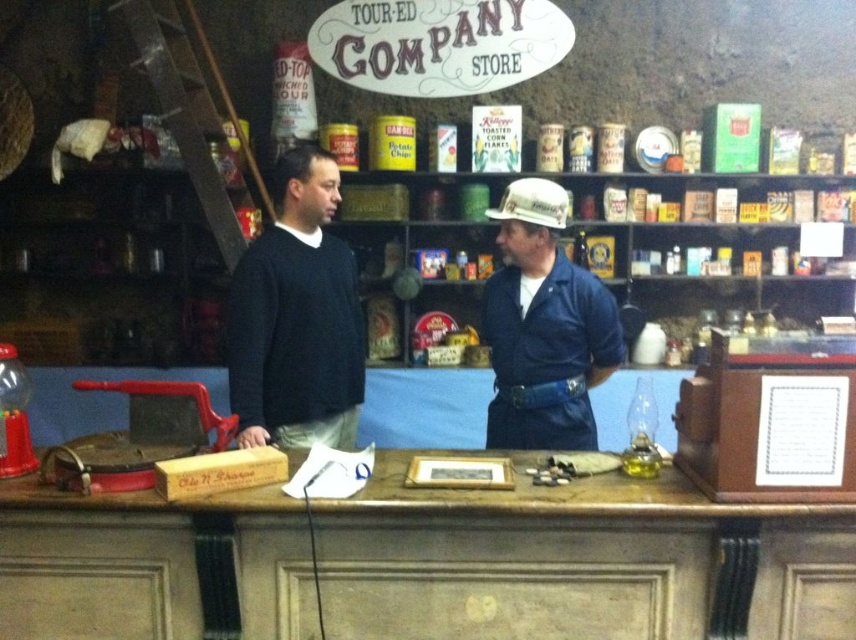
You are standing at the counter in the vintage store and see two points marked on the counter. The first point is at coordinates point (339,408) and the second point is at point (521,204). Which point is closer to you?

Point (339,408) is further to the camera than point (521,204), so the point closer to you is point (521,204).

Looking at this image, you are a customer in the store and want to hang both the dark blue sweater at center and the blue denim shirt at center on a single hanger. The hanger can only support items up to the height of the taller item. Will the hanger be sufficient for both?

The dark blue sweater at center is taller than the blue denim shirt at center. Since the hanger can support up to the height of the taller item, which is the dark blue sweater at center, the hanger will be sufficient for both items.

You are standing 10 feet away from the counter in the vintage store. There is a point at coordinates point (331, 298) on the counter. Can you reach that point without moving closer to the counter?

The distance of point (331, 298) from viewer is 8.62 feet, so yes, you can reach the point since you are currently 10 feet away, which is farther than the point. You can extend your arm to reach it without moving closer.